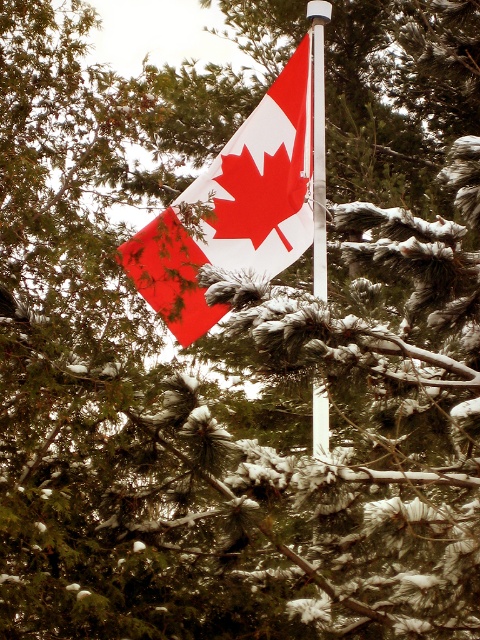
You are a photographer trying to capture the Canadian flag scene. You notice the matte plastic flag at center and the white metallic pole at center. Which object should you focus on if you want to photograph the larger one?

The matte plastic flag at center is bigger than the white metallic pole at center, so you should focus on the matte plastic flag at center to capture the larger object.

You are standing in front of the Canadian flag scene. There is a point marked at coordinates (236,208). Which object in the scene corresponds to this point?

The point at (236,208) corresponds to the matte plastic flag at center.

You are standing in front of the Canadian flag scene. There are two points marked in the image. Which point is closer to you, point (241, 150) or point (313, 252)?

Point (313, 252) is closer to you because the description states that point (241, 150) is further to the camera than point (313, 252).